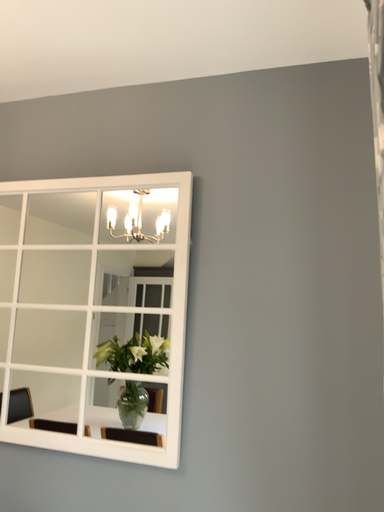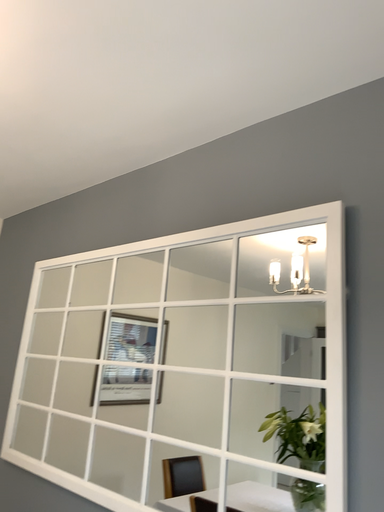
Question: Which way did the camera rotate in the video?

Choices:
 (A) rotated downward
 (B) rotated upward

Answer: (B)